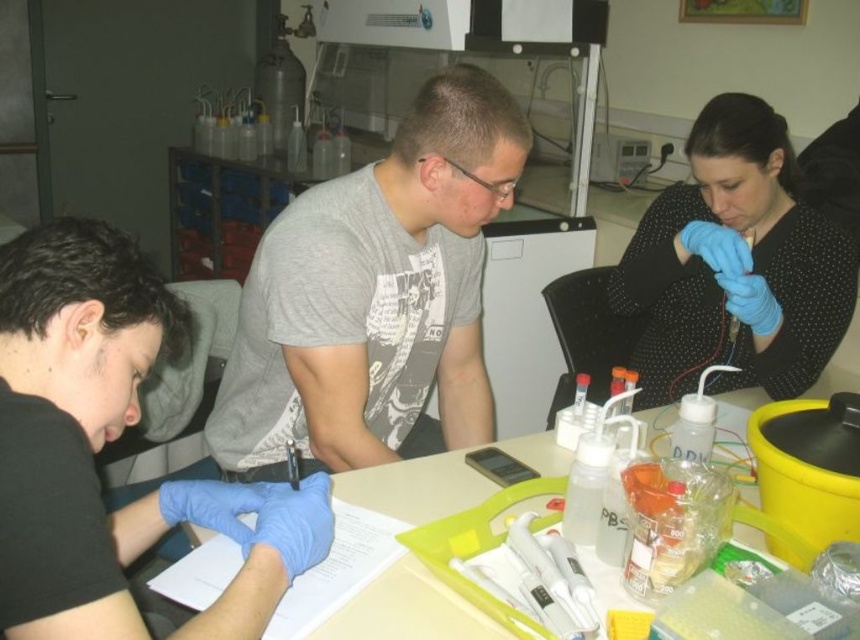
Between point (20, 433) and point (790, 298), which one is positioned in front?

Point (20, 433) is more forward.

Does blue latex gloves at lower left have a lesser width compared to black dotted shirt at upper right?

Yes, blue latex gloves at lower left is thinner than black dotted shirt at upper right.

This screenshot has width=860, height=640. Find the location of `blue latex gloves at lower left`. blue latex gloves at lower left is located at coordinates pyautogui.click(x=112, y=440).

Does gray printed t-shirt at center appear over white plastic table at center?

Yes, gray printed t-shirt at center is above white plastic table at center.

Which is behind, point (447, 282) or point (746, 616)?

Point (447, 282)

This screenshot has width=860, height=640. In order to click on gray printed t-shirt at center in this screenshot , I will do `click(375, 292)`.

Is blue latex gloves at lower left below white plastic table at center?

Incorrect, blue latex gloves at lower left is not positioned below white plastic table at center.

Identify the location of blue latex gloves at lower left. (112, 440).